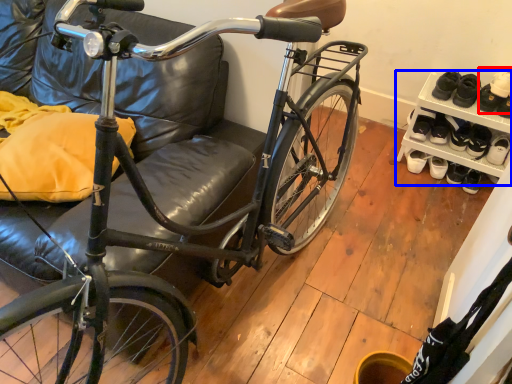
Question: Which of the following is the farthest to the observer, shoe (highlighted by a red box) or shelf (highlighted by a blue box)?

Choices:
 (A) shoe
 (B) shelf

Answer: (A)